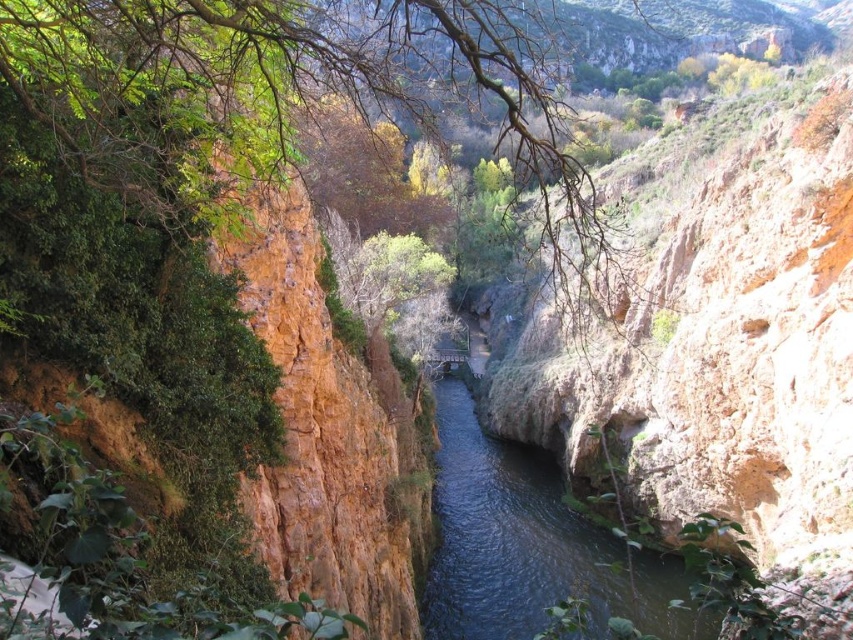
You are a hiker standing at the edge of the canyon and see the green leafy tree at center and the dark blue water at center. Which object is higher in elevation?

The green leafy tree at center is located above the dark blue water at center, so it is higher in elevation.

You are standing at the entrance of the canyon and want to locate the green leafy tree at center. According to the coordinates provided, where should you look relative to your current position?

The green leafy tree at center is located at coordinates point (296,96), which means it is positioned to the left and slightly above your current viewpoint.